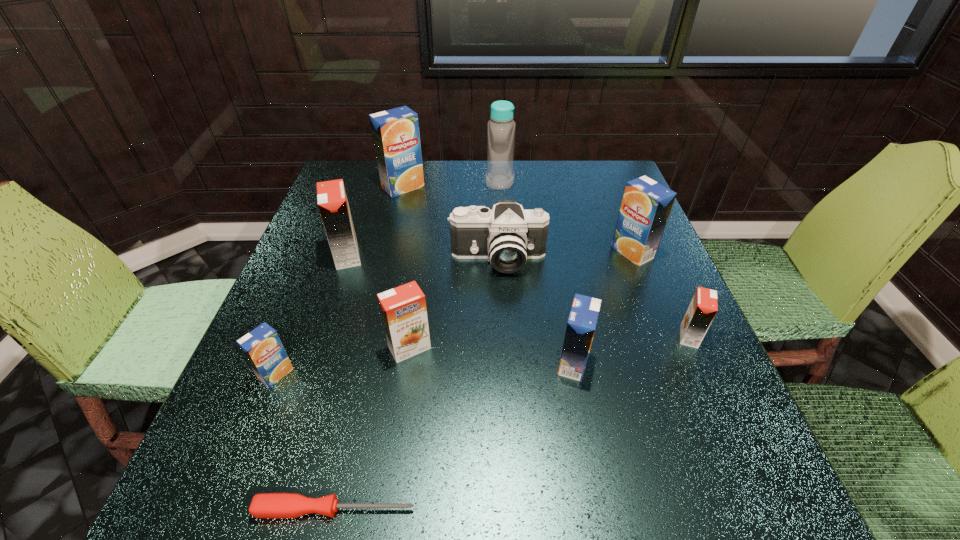
Locate an element on the screen. Image resolution: width=960 pixels, height=540 pixels. unoccupied position between the farthest orange orange juice and the second blue orange_juice from right to left is located at coordinates (460, 309).

At what (x,y) coordinates should I click in order to perform the action: click on unoccupied position between the smallest orange orange juice and the smallest blue orange_juice. Please return your answer as a coordinate pair (x, y). This screenshot has height=540, width=960. Looking at the image, I should click on (483, 355).

Locate an element on the screen. vacant space that is in between the second orange orange juice from right to left and the blue bottle is located at coordinates (455, 265).

Find the location of `vacant space that's between the black camera and the smallest orange orange juice`. vacant space that's between the black camera and the smallest orange orange juice is located at coordinates (593, 298).

At what (x,y) coordinates should I click in order to perform the action: click on blank region between the biggest orange orange juice and the black camera. Please return your answer as a coordinate pair (x, y). This screenshot has height=540, width=960. Looking at the image, I should click on (422, 258).

Find the location of a particular element. Image resolution: width=960 pixels, height=540 pixels. the second closest object to the black camera is located at coordinates (403, 309).

At what (x,y) coordinates should I click in order to perform the action: click on object that stands as the fourth closest to the leftmost blue orange_juice. Please return your answer as a coordinate pair (x, y). The width and height of the screenshot is (960, 540). Looking at the image, I should click on (507, 235).

You are a GUI agent. You are given a task and a screenshot of the screen. Output one action in this format:
    pyautogui.click(x=<x>, y=<y>)
    Task: Click on the closest orange_juice to the second smallest orange orange juice
    The image size is (960, 540).
    Given the screenshot: What is the action you would take?
    pyautogui.click(x=262, y=348)

Identify the location of the closest orange_juice to the second orange orange juice from left to right. tap(262, 348).

Find the location of a particular element. blue orange_juice that is the second closest to the third nearest blue orange_juice is located at coordinates (395, 132).